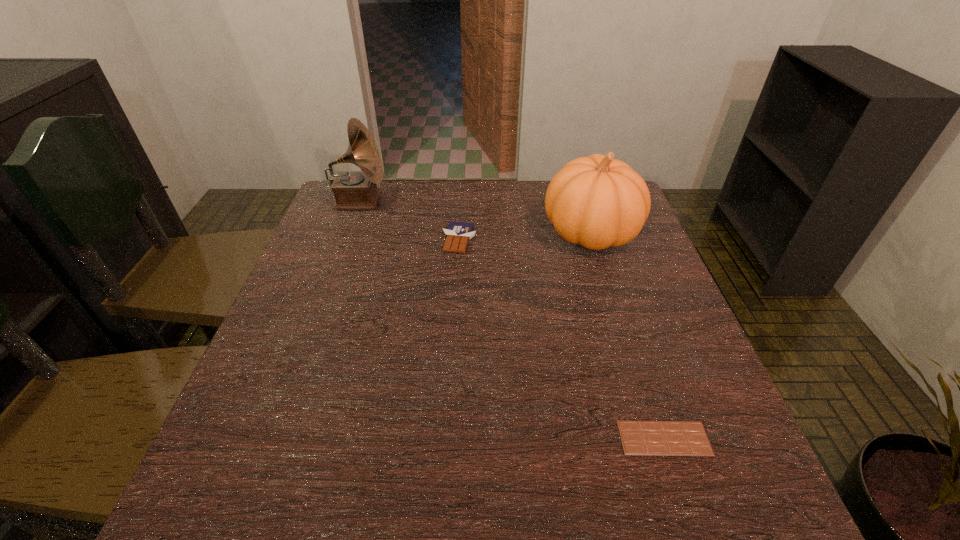
You are a GUI agent. You are given a task and a screenshot of the screen. Output one action in this format:
    pyautogui.click(x=<x>, y=<y>)
    Task: Click on the free space between the leftmost object and the pumpkin
    The image size is (960, 540).
    Given the screenshot: What is the action you would take?
    pyautogui.click(x=475, y=217)

Where is `free spot between the phonograph record and the pumpkin`? free spot between the phonograph record and the pumpkin is located at coordinates (475, 217).

The height and width of the screenshot is (540, 960). Find the location of `free spot between the leftmost object and the third object from right to left`. free spot between the leftmost object and the third object from right to left is located at coordinates (409, 220).

Locate which object ranks second in proximity to the shortest object. Please provide its 2D coordinates. Your answer should be formatted as a tuple, i.e. [(x, y)], where the tuple contains the x and y coordinates of a point satisfying the conditions above.

[(458, 234)]

Identify the location of object that is the closest one to the nearer chocolate bar. (597, 201).

This screenshot has height=540, width=960. I want to click on free space that satisfies the following two spatial constraints: 1. on the front side of the shortest object; 2. on the left side of the left chocolate bar, so click(x=447, y=438).

Locate an element on the screen. The height and width of the screenshot is (540, 960). free region that satisfies the following two spatial constraints: 1. on the horn of the pumpkin; 2. on the left side of the phonograph record is located at coordinates (348, 232).

Where is `free space in the image that satisfies the following two spatial constraints: 1. on the horn of the shortest object; 2. on the left side of the leftmost object`? The image size is (960, 540). free space in the image that satisfies the following two spatial constraints: 1. on the horn of the shortest object; 2. on the left side of the leftmost object is located at coordinates (270, 438).

At what (x,y) coordinates should I click in order to perform the action: click on vacant space that satisfies the following two spatial constraints: 1. on the horn of the phonograph record; 2. on the left side of the nearer chocolate bar. Please return your answer as a coordinate pair (x, y). Looking at the image, I should click on (270, 438).

Image resolution: width=960 pixels, height=540 pixels. What are the coordinates of `free point that satisfies the following two spatial constraints: 1. on the horn of the third object from right to left; 2. on the left side of the leftmost object` in the screenshot? It's located at (345, 240).